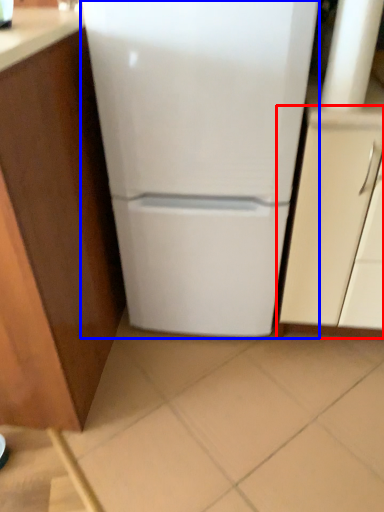
Question: Which point is further to the camera, cabinetry (highlighted by a red box) or refrigerator (highlighted by a blue box)?

Choices:
 (A) cabinetry
 (B) refrigerator

Answer: (A)